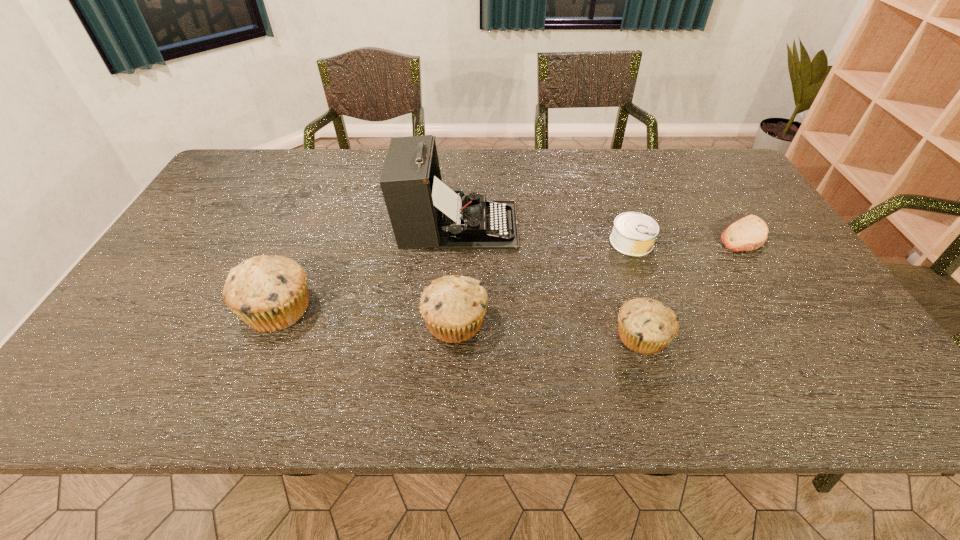
Given the evenly spaced muffins in the image, where should an extra muffin be added on the right to preserve the spacing? Please point to a vacant space. Please provide its 2D coordinates. Your answer should be formatted as a tuple, i.e. [(x, y)], where the tuple contains the x and y coordinates of a point satisfying the conditions above.

[(839, 352)]